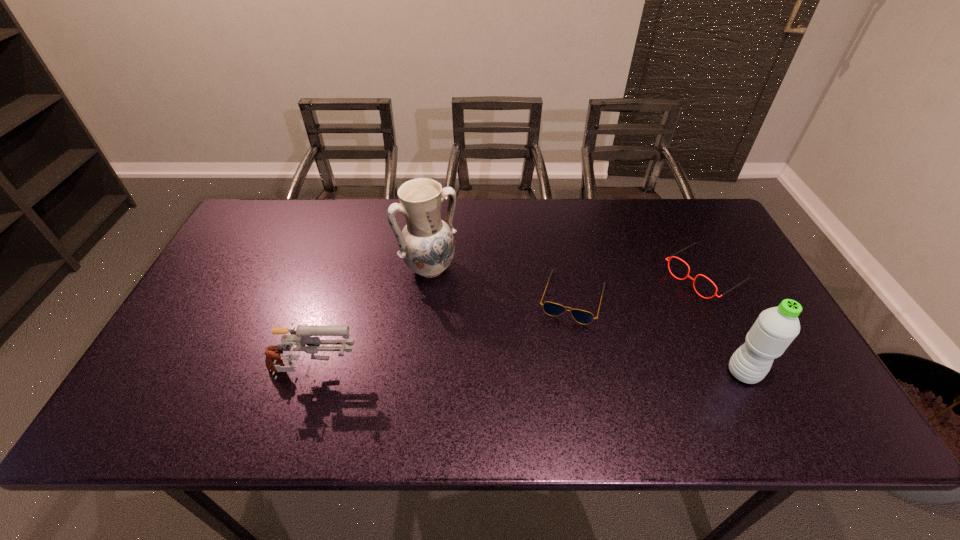
Locate an element on the screen. The width and height of the screenshot is (960, 540). vacant space in between the spectacles and the shortest object is located at coordinates (639, 286).

This screenshot has height=540, width=960. I want to click on vacant space that's between the pottery and the leftmost object, so click(x=372, y=322).

Find the location of a particular element. The height and width of the screenshot is (540, 960). vacant space in between the fourth object from right to left and the third object from right to left is located at coordinates (501, 282).

I want to click on blank region between the third shortest object and the third object from left to right, so click(443, 336).

At what (x,y) coordinates should I click in order to perform the action: click on empty location between the water bottle and the spectacles. Please return your answer as a coordinate pair (x, y). Looking at the image, I should click on (725, 324).

Where is `empty space between the fourth shortest object and the sunglasses`? Image resolution: width=960 pixels, height=540 pixels. empty space between the fourth shortest object and the sunglasses is located at coordinates (658, 335).

At what (x,y) coordinates should I click in order to perform the action: click on empty space between the second object from left to right and the fourth tallest object. Please return your answer as a coordinate pair (x, y). The width and height of the screenshot is (960, 540). Looking at the image, I should click on (568, 272).

Choose which object is the nearest neighbor to the second object from left to right. Please provide its 2D coordinates. Your answer should be formatted as a tuple, i.e. [(x, y)], where the tuple contains the x and y coordinates of a point satisfying the conditions above.

[(553, 309)]

In order to click on object that is the third closest to the second object from left to right in this screenshot , I will do point(672,256).